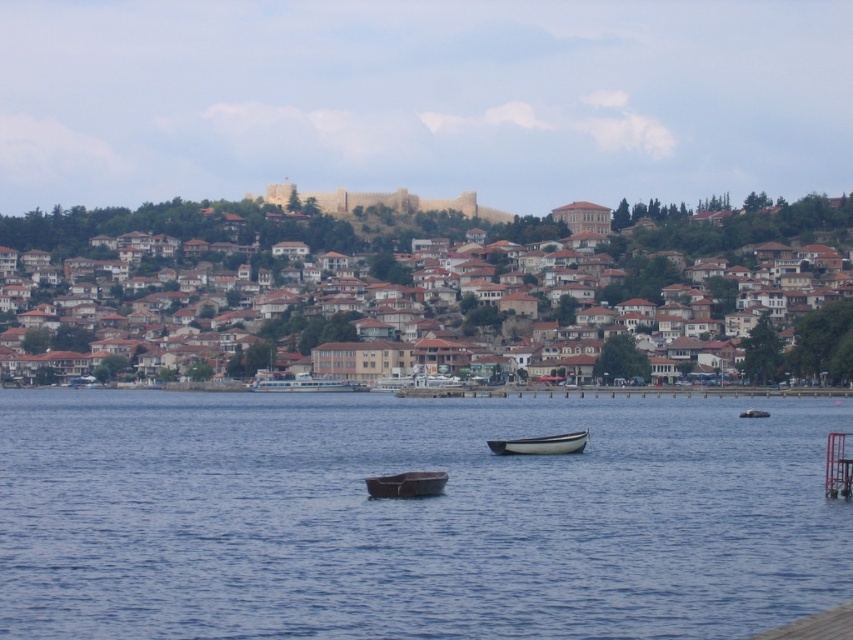
You are standing at the point with coordinates (300, 381) in the waterfront scene. What object is located exactly at that point?

The white glossy ferry at center is located exactly at point (300, 381).

You are standing at the waterfront and want to walk from point A to point B. Point A is located at coordinate point A is point (811, 294) and point B is located at point (527, 436). Which point is closer to you when you start walking?

Point A is point (811, 294) is further to the viewer than point (527, 436), so point B is closer to you when you start walking.

You are standing at the point marked as point (691,280) in the image. What object is exactly at this location?

The brown clay houses at upper center are located exactly at point (691,280).